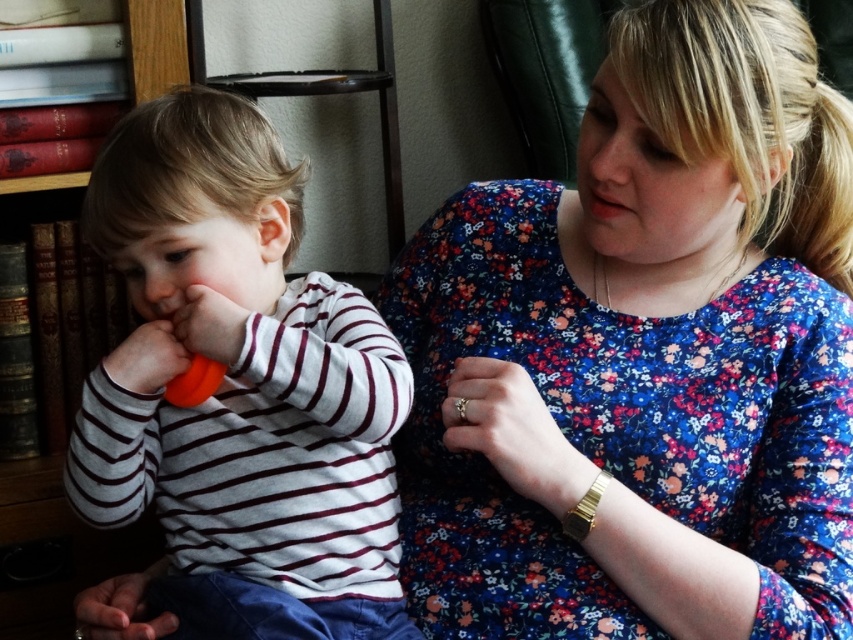
Question: Considering the real-world distances, which object is closest to the orange rubber teether at left?

Choices:
 (A) blue floral dress at center
 (B) red leather bookshelf at left

Answer: (A)

Question: Which of the following is the closest to the observer?

Choices:
 (A) (180, 182)
 (B) (747, 154)
 (C) (144, 545)

Answer: (B)

Question: Can you confirm if blue floral dress at center is positioned to the right of orange rubber teether at left?

Choices:
 (A) no
 (B) yes

Answer: (B)

Question: Is orange rubber teether at left further to the viewer compared to red leather bookshelf at left?

Choices:
 (A) yes
 (B) no

Answer: (B)

Question: Which point is closer to the camera taking this photo?

Choices:
 (A) (160, 40)
 (B) (381, 612)
 (C) (672, 68)

Answer: (C)

Question: In this image, where is blue floral dress at center located relative to red leather bookshelf at left?

Choices:
 (A) right
 (B) left

Answer: (A)